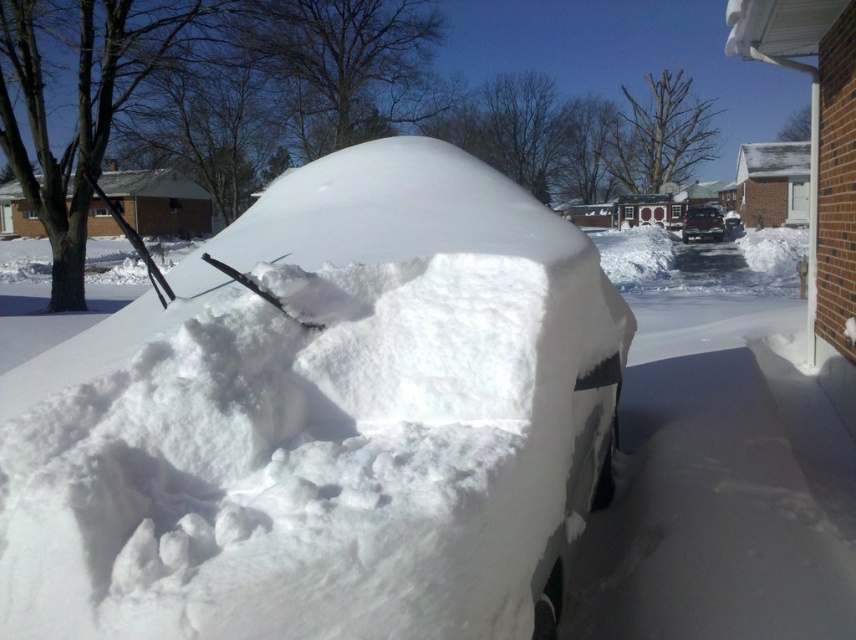
Question: Which of the following is the closest to the observer?

Choices:
 (A) white fluffy snow at center
 (B) black glossy suv at center

Answer: (A)

Question: Among these objects, which one is nearest to the camera?

Choices:
 (A) white fluffy snow at center
 (B) black glossy suv at center

Answer: (A)

Question: Is white fluffy snow at center smaller than black glossy suv at center?

Choices:
 (A) no
 (B) yes

Answer: (A)

Question: Can you confirm if white fluffy snow at center is positioned below black glossy suv at center?

Choices:
 (A) yes
 (B) no

Answer: (A)

Question: Does white fluffy snow at center have a lesser width compared to black glossy suv at center?

Choices:
 (A) no
 (B) yes

Answer: (A)

Question: Which point is farther to the camera?

Choices:
 (A) (465, 618)
 (B) (696, 234)

Answer: (B)